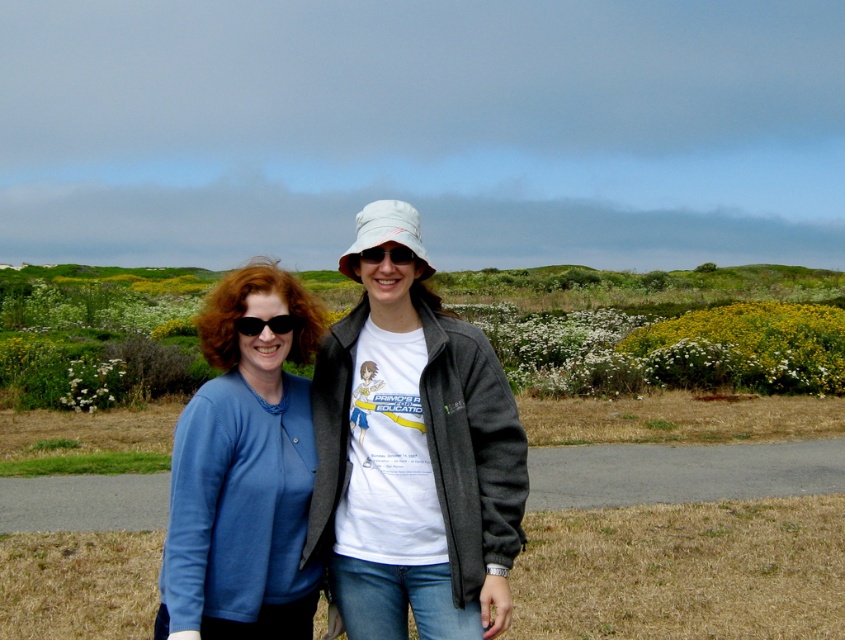
Question: Which of the following is the closest to the observer?

Choices:
 (A) black plastic sunglasses at center
 (B) matte white hat at center
 (C) matte blue cardigan at left
 (D) white fabric baseball hat at center

Answer: (C)

Question: Considering the relative positions of matte blue cardigan at left and white fabric baseball hat at center in the image provided, where is matte blue cardigan at left located with respect to white fabric baseball hat at center?

Choices:
 (A) left
 (B) right

Answer: (B)

Question: Is white fabric baseball hat at center positioned at the back of black plastic sunglasses at center?

Choices:
 (A) yes
 (B) no

Answer: (A)

Question: Does matte blue cardigan at left come behind white fabric baseball hat at center?

Choices:
 (A) yes
 (B) no

Answer: (B)

Question: Estimate the real-world distances between objects in this image. Which object is farther from the black plastic sunglasses at center?

Choices:
 (A) matte white hat at center
 (B) matte blue cardigan at left

Answer: (B)

Question: Which point is farther to the camera?

Choices:
 (A) (404, 248)
 (B) (407, 228)
 (C) (178, 561)

Answer: (B)